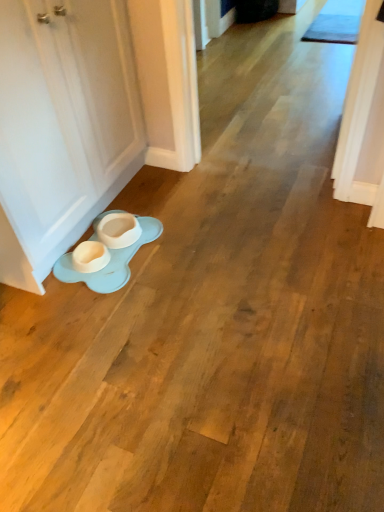
This screenshot has width=384, height=512. I want to click on vacant space underneath white matte door at lower left (from a real-world perspective), so click(127, 204).